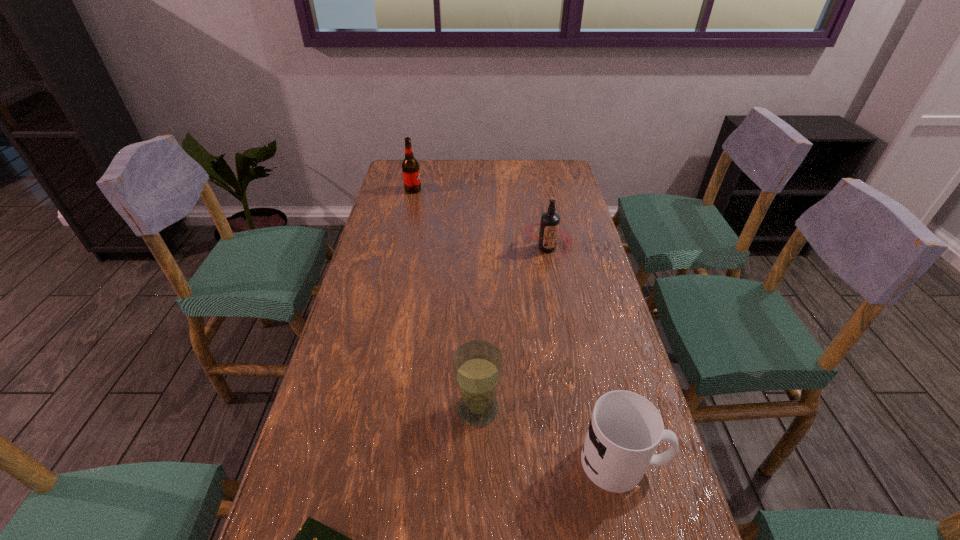
At what (x,y) coordinates should I click in order to perform the action: click on the farther root beer. Please return your answer as a coordinate pair (x, y). Looking at the image, I should click on (410, 167).

In order to click on the farthest object in this screenshot , I will do `click(410, 167)`.

Identify the location of the nearer root beer. click(549, 226).

Where is `the right root beer`? the right root beer is located at coordinates pos(549,226).

Locate an element on the screen. the third nearest object is located at coordinates (477, 365).

Locate an element on the screen. The image size is (960, 540). the third object from left to right is located at coordinates (477, 365).

You are a GUI agent. You are given a task and a screenshot of the screen. Output one action in this format:
    pyautogui.click(x=<x>, y=<y>)
    Task: Click on the mug
    
    Given the screenshot: What is the action you would take?
    (625, 429)

You are a GUI agent. You are given a task and a screenshot of the screen. Output one action in this format:
    pyautogui.click(x=<x>, y=<y>)
    Task: Click on the free spot located 0.220m on the right of the farther root beer
    The height and width of the screenshot is (540, 960).
    Given the screenshot: What is the action you would take?
    pyautogui.click(x=478, y=190)

Identify the location of blank space located on the label of the fourth nearest object. The width and height of the screenshot is (960, 540). (566, 350).

Where is `vacant space situated on the back of the third farthest object`? vacant space situated on the back of the third farthest object is located at coordinates (478, 286).